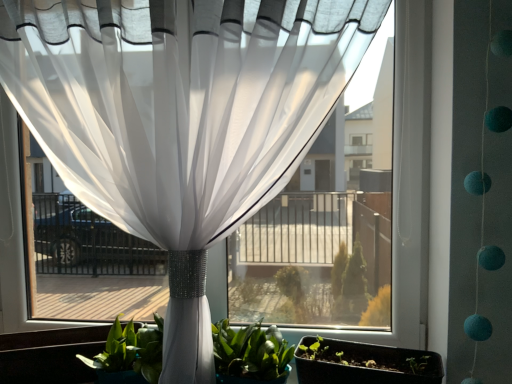
Question: From the image's perspective, is green leafy plant at center located above or below matte black flowerpot at lower right?

Choices:
 (A) above
 (B) below

Answer: (A)

Question: Considering the positions of green leafy plant at center and matte black flowerpot at lower right in the image, is green leafy plant at center bigger or smaller than matte black flowerpot at lower right?

Choices:
 (A) big
 (B) small

Answer: (A)

Question: Is green leafy plant at center to the left or to the right of matte black flowerpot at lower right in the image?

Choices:
 (A) left
 (B) right

Answer: (A)

Question: Considering the positions of matte black flowerpot at lower right and green leafy plant at center in the image, is matte black flowerpot at lower right wider or thinner than green leafy plant at center?

Choices:
 (A) wide
 (B) thin

Answer: (B)

Question: Which is correct: matte black flowerpot at lower right is inside green leafy plant at center, or outside of it?

Choices:
 (A) outside
 (B) inside

Answer: (A)

Question: From the image's perspective, is matte black flowerpot at lower right located above or below green leafy plant at center?

Choices:
 (A) above
 (B) below

Answer: (B)

Question: Considering the positions of matte black flowerpot at lower right and green leafy plant at center in the image, is matte black flowerpot at lower right taller or shorter than green leafy plant at center?

Choices:
 (A) short
 (B) tall

Answer: (A)